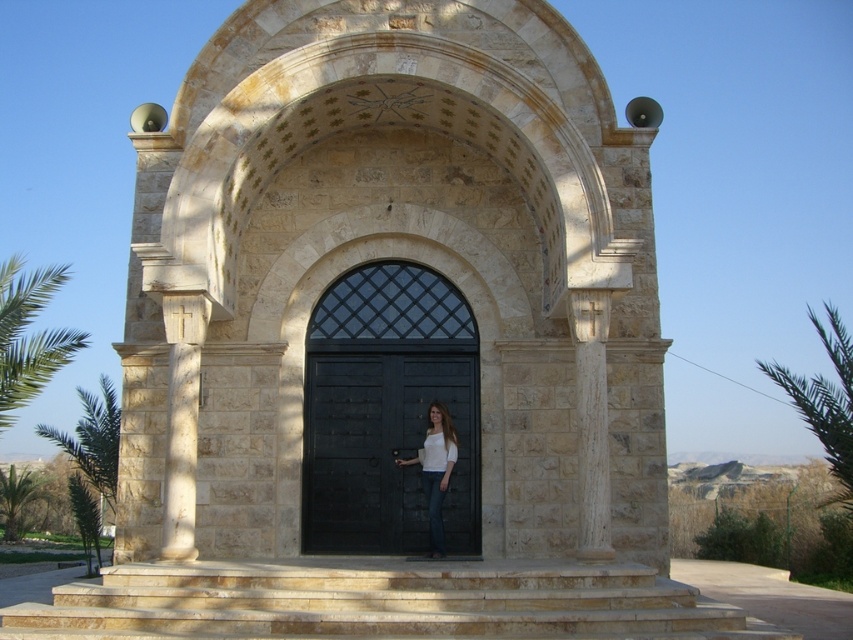
Does light beige stone column at center-left appear on the right side of white stone cross at center?

Incorrect, light beige stone column at center-left is not on the right side of white stone cross at center.

Consider the image. Can you confirm if light beige stone column at center-left is positioned below white stone cross at center?

Indeed, light beige stone column at center-left is positioned under white stone cross at center.

Where is `light beige stone column at center-left`? The width and height of the screenshot is (853, 640). light beige stone column at center-left is located at coordinates (183, 419).

At what (x,y) coordinates should I click in order to perform the action: click on black wooden door at center. Please return your answer as a coordinate pair (x, y). The width and height of the screenshot is (853, 640). Looking at the image, I should click on (386, 451).

Can you confirm if black wooden door at center is positioned above white matte shirt at center?

Yes, black wooden door at center is above white matte shirt at center.

Between point (447, 506) and point (451, 428), which one is positioned in front?

Point (451, 428) is more forward.

At what (x,y) coordinates should I click in order to perform the action: click on black wooden door at center. Please return your answer as a coordinate pair (x, y). Looking at the image, I should click on (386, 451).

Does beige stone stairs at center appear under white matte shirt at center?

Correct, beige stone stairs at center is located below white matte shirt at center.

Is point (33, 627) in front of point (450, 445)?

Yes.

Is point (608, 598) closer to camera compared to point (428, 445)?

Yes.

Locate an element on the screen. beige stone stairs at center is located at coordinates (380, 602).